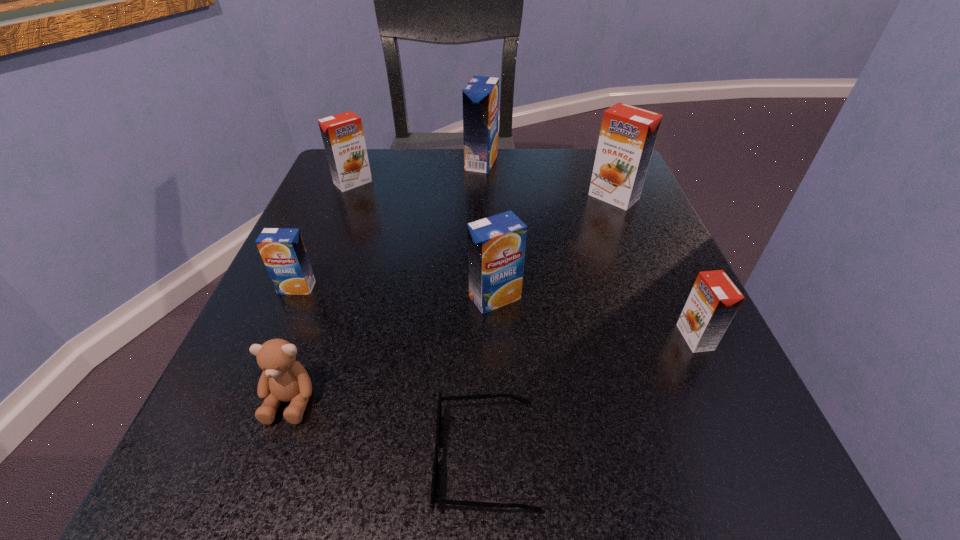
Find the location of a particular element. vacant region located 0.080m on the front of the biggest blue orange_juice is located at coordinates (481, 193).

The width and height of the screenshot is (960, 540). Find the location of `vacant space situated on the left of the biggest orange orange juice`. vacant space situated on the left of the biggest orange orange juice is located at coordinates [x=426, y=197].

This screenshot has height=540, width=960. Find the location of `vacant space situated on the back of the leftmost orange orange juice`. vacant space situated on the back of the leftmost orange orange juice is located at coordinates (361, 163).

Identify the location of free space located 0.200m on the left of the second smallest blue orange_juice. (344, 298).

Image resolution: width=960 pixels, height=540 pixels. Find the location of `vacant space located 0.330m on the right of the leftmost blue orange_juice`. vacant space located 0.330m on the right of the leftmost blue orange_juice is located at coordinates (515, 287).

I want to click on vacant region located 0.370m on the left of the third nearest object, so click(430, 337).

This screenshot has width=960, height=540. I want to click on vacant space located 0.060m on the front-facing side of the brown teddy bear, so click(264, 475).

The width and height of the screenshot is (960, 540). Find the location of `free space located on the front-facing side of the sunglasses`. free space located on the front-facing side of the sunglasses is located at coordinates (318, 456).

You are a GUI agent. You are given a task and a screenshot of the screen. Output one action in this format:
    pyautogui.click(x=<x>, y=<y>)
    Task: Click on the vacant space located on the front-facing side of the sunglasses
    The height and width of the screenshot is (540, 960).
    Given the screenshot: What is the action you would take?
    pyautogui.click(x=190, y=456)

Where is `free location located 0.050m on the front-facing side of the sunglasses`? This screenshot has width=960, height=540. free location located 0.050m on the front-facing side of the sunglasses is located at coordinates [x=395, y=456].